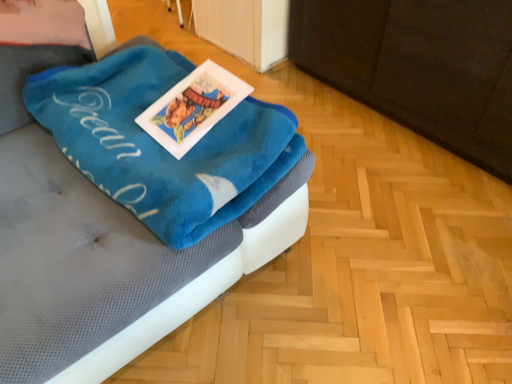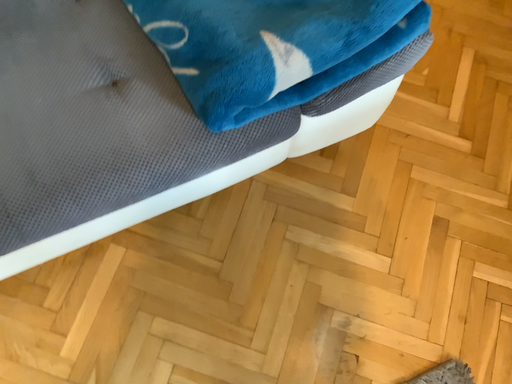
Question: Which way did the camera rotate in the video?

Choices:
 (A) rotated right
 (B) rotated left

Answer: (B)